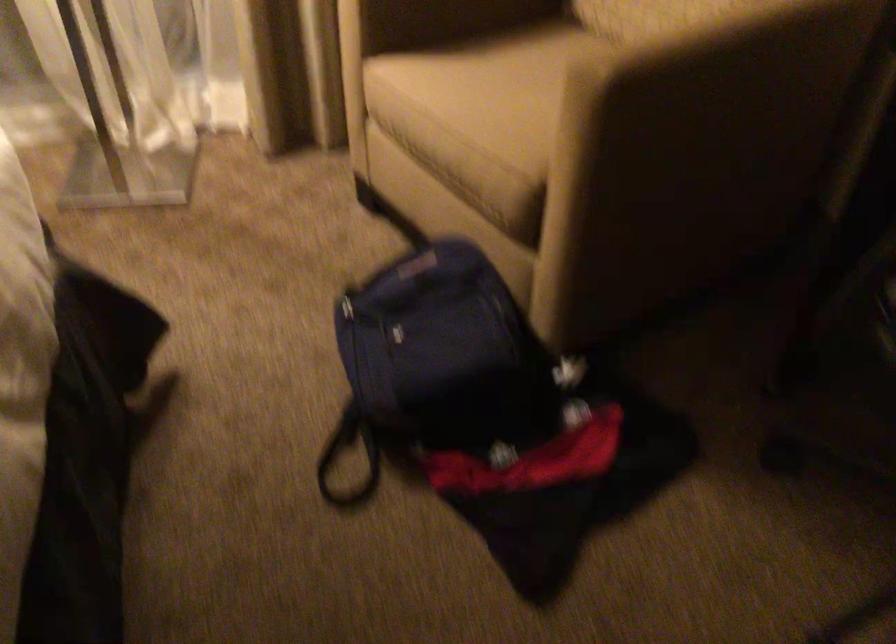
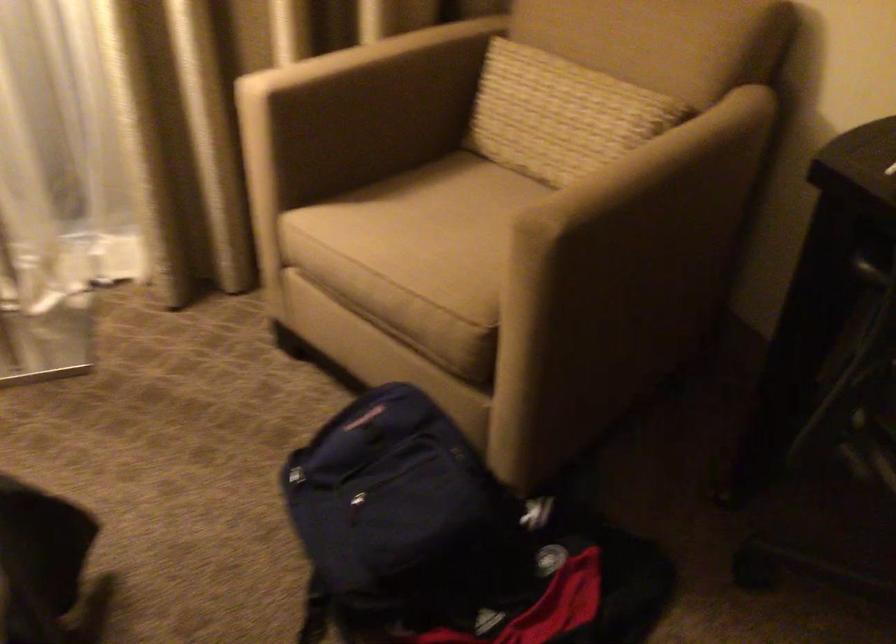
Question: The images are taken continuously from a first-person perspective. In which direction is your viewpoint rotating?

Choices:
 (A) Left
 (B) Right
 (C) Up
 (D) Down

Answer: (B)